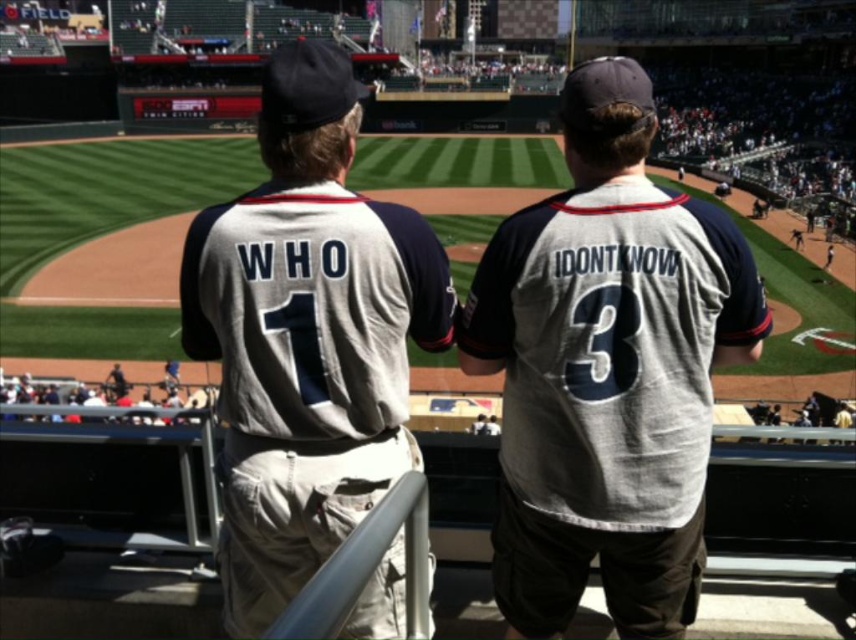
Who is positioned more to the left, gray jersey at center or gray cotton jersey at center?

From the viewer's perspective, gray cotton jersey at center appears more on the left side.

Which of these two, gray jersey at center or gray cotton jersey at center, stands taller?

With more height is gray cotton jersey at center.

Is point (669, 333) farther from camera compared to point (298, 280)?

Yes, point (669, 333) is behind point (298, 280).

The width and height of the screenshot is (856, 640). I want to click on gray jersey at center, so click(x=607, y=371).

Is gray cotton jersey at center shorter than matte gray jersey at center?

No.

Can you confirm if gray cotton jersey at center is bigger than matte gray jersey at center?

Indeed, gray cotton jersey at center has a larger size compared to matte gray jersey at center.

Who is more distant from viewer, (358,300) or (122,392)?

The point (122,392) is more distant.

This screenshot has width=856, height=640. I want to click on gray cotton jersey at center, so click(307, 336).

Which of these two, gray jersey at center or matte gray jersey at center, stands shorter?

matte gray jersey at center is shorter.

Where is `gray jersey at center`? gray jersey at center is located at coordinates (607, 371).

Who is more distant from viewer, (583, 548) or (116, 369)?

Point (116, 369)

Where is `gray jersey at center`? This screenshot has width=856, height=640. gray jersey at center is located at coordinates (607, 371).